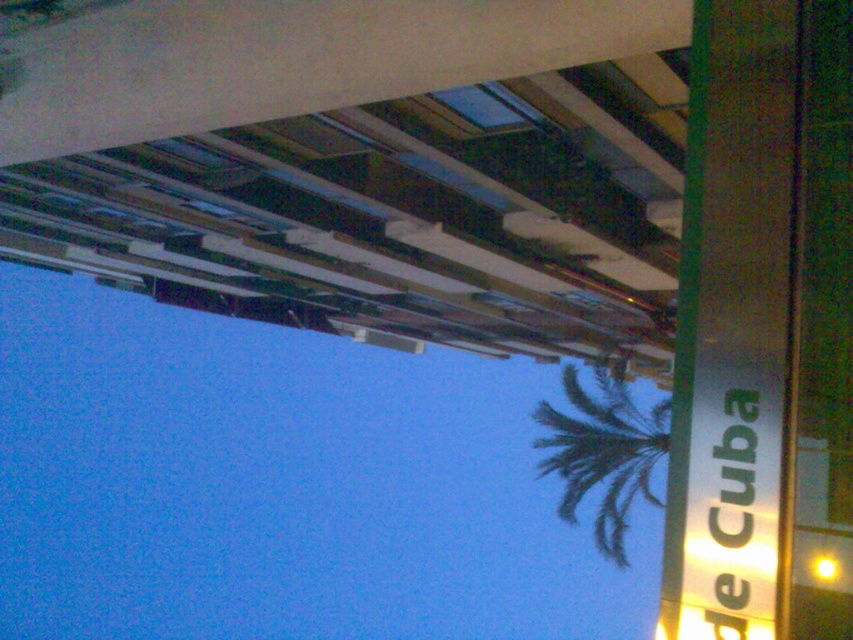
You are standing in front of the modern building and want to place a new decorative item between the silver metallic sign at right and the green leafy palm tree at center. Based on their positions, which object should the new item be closer to?

The silver metallic sign at right is to the left of the green leafy palm tree at center, so the new decorative item should be placed closer to the silver metallic sign at right to maintain symmetry between them.

You are standing at the base of the palm tree in the foreground and want to take a photo of the modern architectural structure. To ensure both points, point (718, 419) and point (610, 531), are visible in your photo, which point should you focus on first?

You should focus on point (718, 419) first because it is in front of point (610, 531) and will be closer to your camera position.